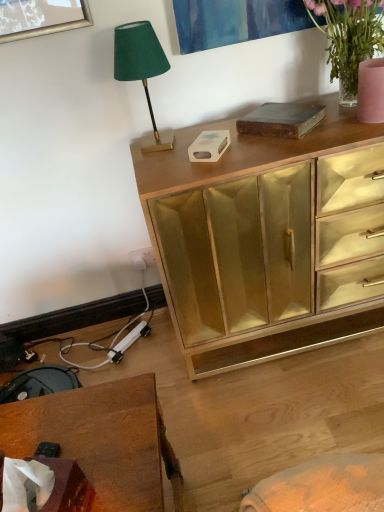
Where is `vacant space in front of gold mirrored cabinet at upper center`? Image resolution: width=384 pixels, height=512 pixels. vacant space in front of gold mirrored cabinet at upper center is located at coordinates pos(300,403).